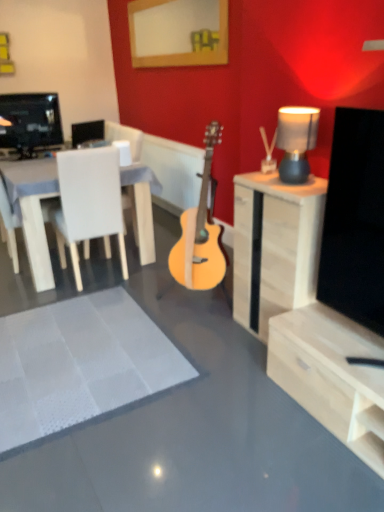
Question: Is matte gray lampshade at upper right at the back of light wood acoustic guitar at center?

Choices:
 (A) no
 (B) yes

Answer: (A)

Question: Is light wood acoustic guitar at center beside matte gray lampshade at upper right?

Choices:
 (A) yes
 (B) no

Answer: (B)

Question: Is light wood acoustic guitar at center positioned behind matte gray lampshade at upper right?

Choices:
 (A) yes
 (B) no

Answer: (A)

Question: Can you confirm if light wood acoustic guitar at center is taller than matte gray lampshade at upper right?

Choices:
 (A) no
 (B) yes

Answer: (B)

Question: Is light wood acoustic guitar at center positioned before matte gray lampshade at upper right?

Choices:
 (A) no
 (B) yes

Answer: (A)

Question: Would you say white matte chair at left is inside or outside light wood cabinet at right?

Choices:
 (A) inside
 (B) outside

Answer: (B)

Question: From the image's perspective, relative to light wood cabinet at right, is white matte chair at left above or below?

Choices:
 (A) above
 (B) below

Answer: (A)

Question: Does point (77, 289) appear closer or farther from the camera than point (251, 178)?

Choices:
 (A) closer
 (B) farther

Answer: (B)

Question: In terms of width, does white matte chair at left look wider or thinner when compared to light wood cabinet at right?

Choices:
 (A) thin
 (B) wide

Answer: (B)

Question: Is point (62, 266) positioned closer to the camera than point (160, 385)?

Choices:
 (A) farther
 (B) closer

Answer: (A)

Question: Relative to white textured rug at center, is white matte chair at left in front or behind?

Choices:
 (A) front
 (B) behind

Answer: (B)

Question: Is white matte chair at left taller or shorter than white textured rug at center?

Choices:
 (A) short
 (B) tall

Answer: (B)

Question: Based on their positions, is white matte chair at left located to the left or right of white textured rug at center?

Choices:
 (A) left
 (B) right

Answer: (A)

Question: Is light wood cabinet at right bigger or smaller than wooden picture frame at upper center?

Choices:
 (A) big
 (B) small

Answer: (A)

Question: Is point pos(286,242) positioned closer to the camera than point pos(145,60)?

Choices:
 (A) farther
 (B) closer

Answer: (B)